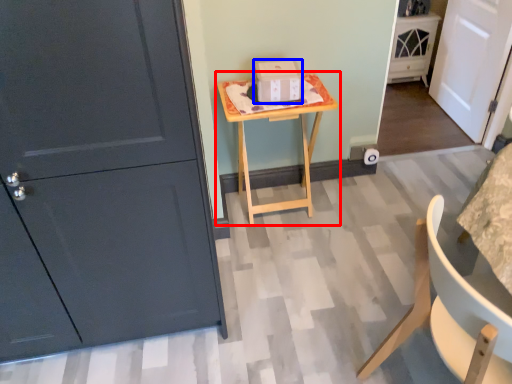
Question: Which of the following is the farthest to the observer, table (highlighted by a red box) or cardboard box (highlighted by a blue box)?

Choices:
 (A) table
 (B) cardboard box

Answer: (B)